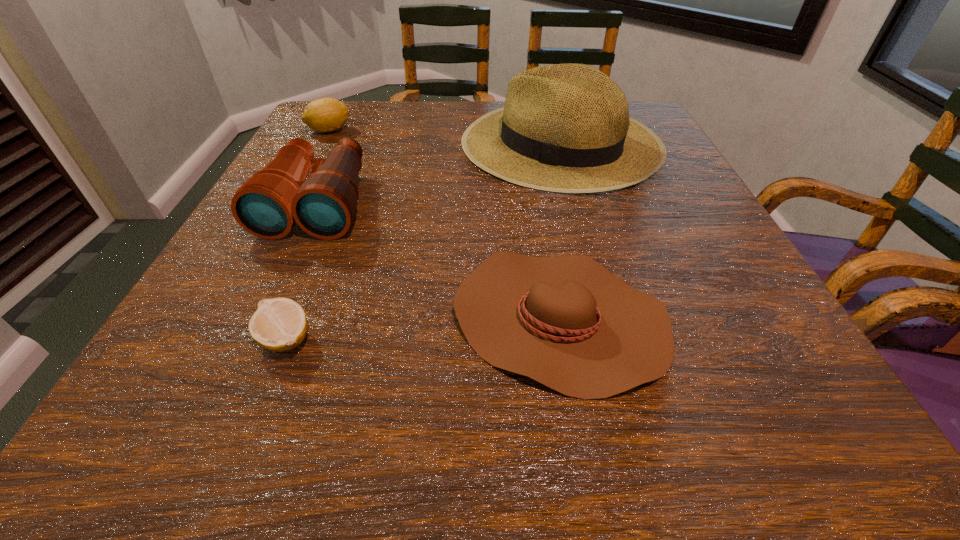
Locate an element on the screen. vacant space at the near edge is located at coordinates (659, 406).

Identify the location of free space at the left edge. The width and height of the screenshot is (960, 540). (258, 279).

Image resolution: width=960 pixels, height=540 pixels. In the image, there is a desktop. Identify the location of vacant area at the right edge. pos(740,354).

The height and width of the screenshot is (540, 960). I want to click on free space at the far left corner of the desktop, so [x=350, y=110].

This screenshot has width=960, height=540. In the image, there is a desktop. Identify the location of free space at the near left corner. (147, 407).

In the image, there is a desktop. Where is `blank space at the near right corner`? blank space at the near right corner is located at coordinates (752, 450).

Find the location of a particular element. This screenshot has height=540, width=960. vacant area between the second tallest object and the shortest object is located at coordinates (301, 271).

Identify the location of free point between the tallest object and the nearer lemon. The width and height of the screenshot is (960, 540). (423, 241).

I want to click on free space between the sunhat and the taller lemon, so click(x=444, y=137).

Image resolution: width=960 pixels, height=540 pixels. Identify the location of vacant space in between the cowboy hat and the shorter lemon. (422, 328).